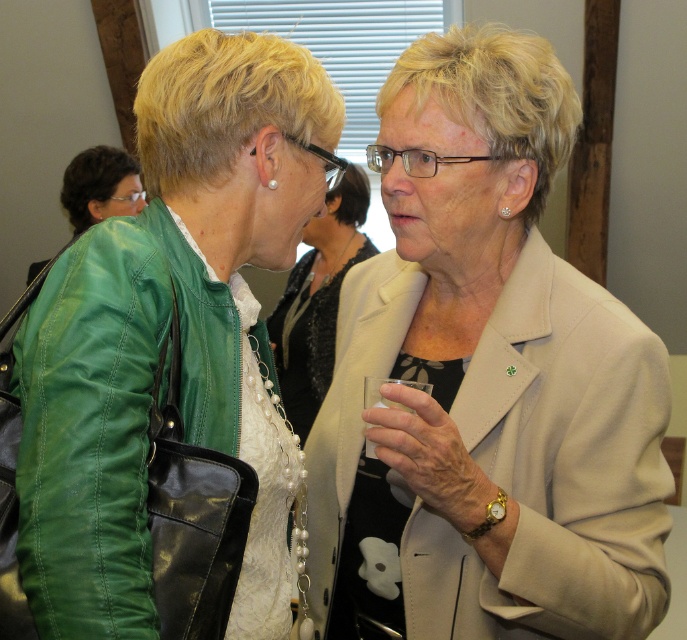
Question: Can you confirm if green leather jacket at left is wider than matte beige blazer at center?

Choices:
 (A) yes
 (B) no

Answer: (B)

Question: Is beige satin blazer at center in front of green leather jacket at left?

Choices:
 (A) no
 (B) yes

Answer: (A)

Question: Observing the image, what is the correct spatial positioning of green leather jacket at left in reference to matte beige blazer at center?

Choices:
 (A) right
 (B) left

Answer: (B)

Question: Estimate the real-world distances between objects in this image. Which object is closer to the matte beige blazer at center?

Choices:
 (A) beige satin blazer at center
 (B) green leather jacket at left

Answer: (A)

Question: Which point appears farthest from the camera in this image?

Choices:
 (A) (308, 429)
 (B) (306, 109)
 (C) (554, 470)

Answer: (A)

Question: Considering the real-world distances, which object is farthest from the matte beige blazer at center?

Choices:
 (A) green leather jacket at left
 (B) beige satin blazer at center

Answer: (A)